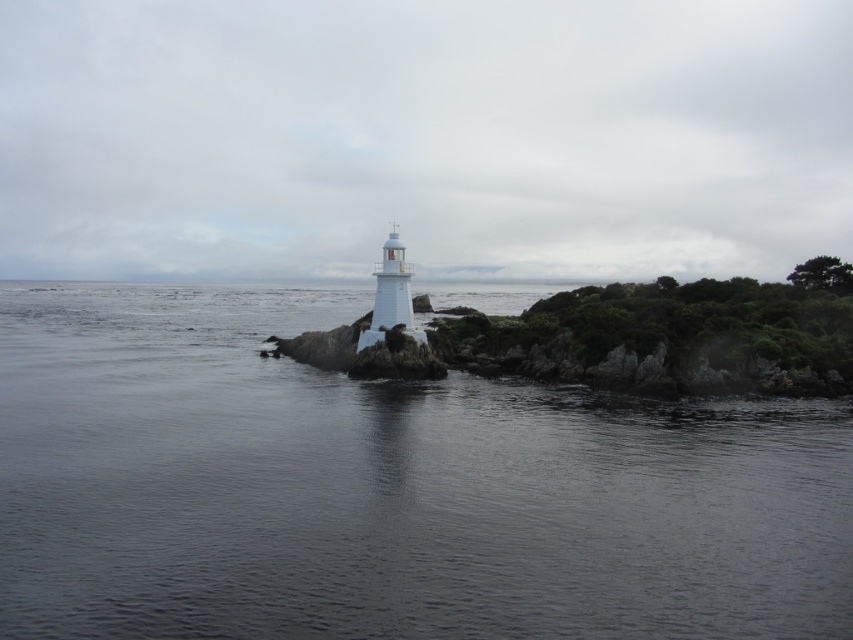
You are a photographer positioned at the edge of the rocky outcrop. You want to capture the white glossy lighthouse at center and the transparent water at center in a single shot. Which object should you frame first to ensure both are in the shot?

You should frame the white glossy lighthouse at center first because the transparent water at center is to the left of it, so positioning the lighthouse first ensures both are included in the shot.

You are a bird flying over the coastal scene. You see the transparent water at center and the white glossy lighthouse at center. Which object is positioned higher from your perspective?

The white glossy lighthouse at center is positioned higher than the transparent water at center because the transparent water at center is located below it.